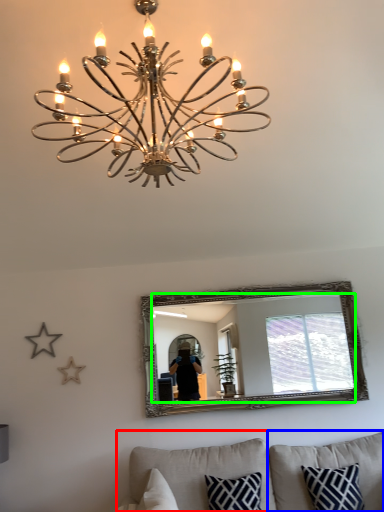
Question: Considering the real-world distances, which object is closest to studio couch (highlighted by a red box)? pillow (highlighted by a blue box) or mirror (highlighted by a green box).

Choices:
 (A) pillow
 (B) mirror

Answer: (A)